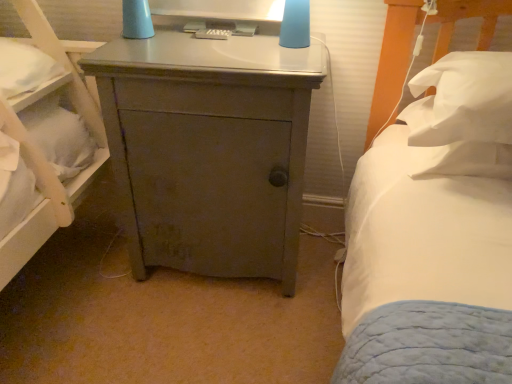
Image resolution: width=512 pixels, height=384 pixels. Identify the location of empty space that is in between matte blue lampshade at upper center and matte plastic remote control at upper center. (220, 43).